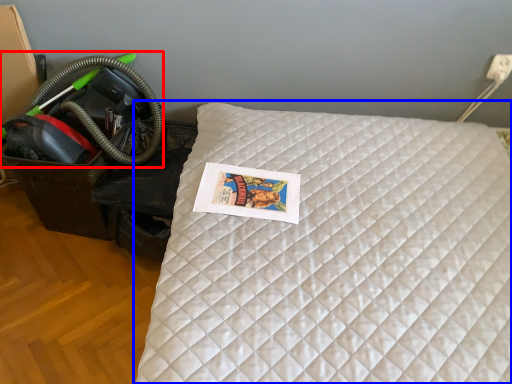
Question: Which object appears farthest to the camera in this image, garden hose (highlighted by a red box) or bed (highlighted by a blue box)?

Choices:
 (A) garden hose
 (B) bed

Answer: (A)